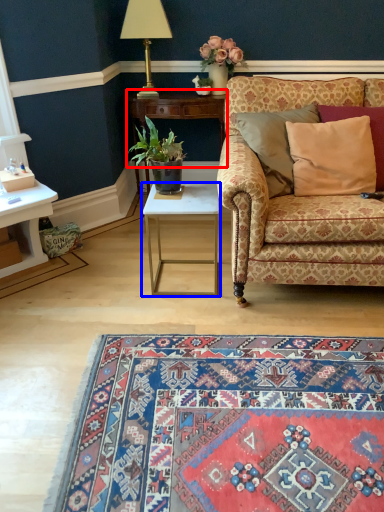
Question: Among these objects, which one is nearest to the camera, table (highlighted by a red box) or table (highlighted by a blue box)?

Choices:
 (A) table
 (B) table

Answer: (B)